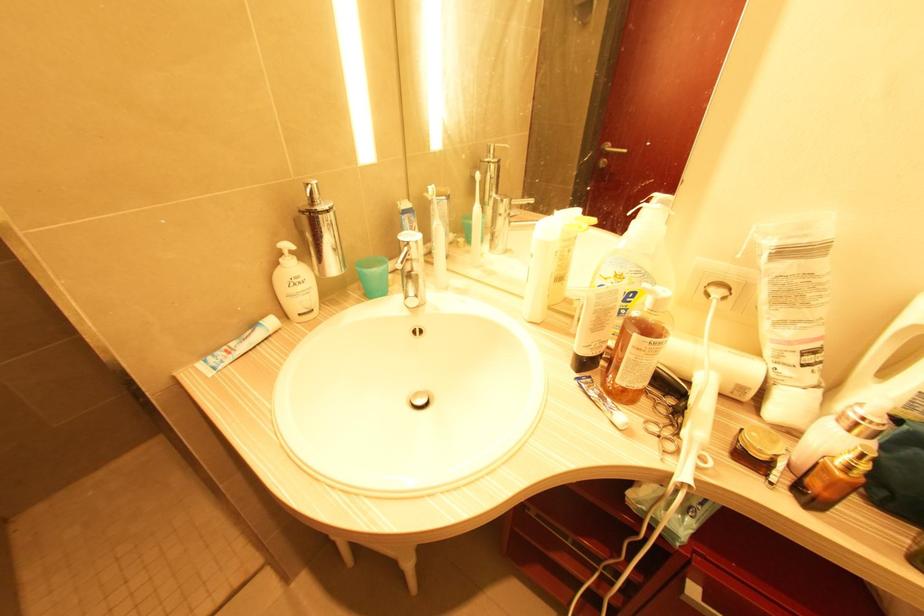
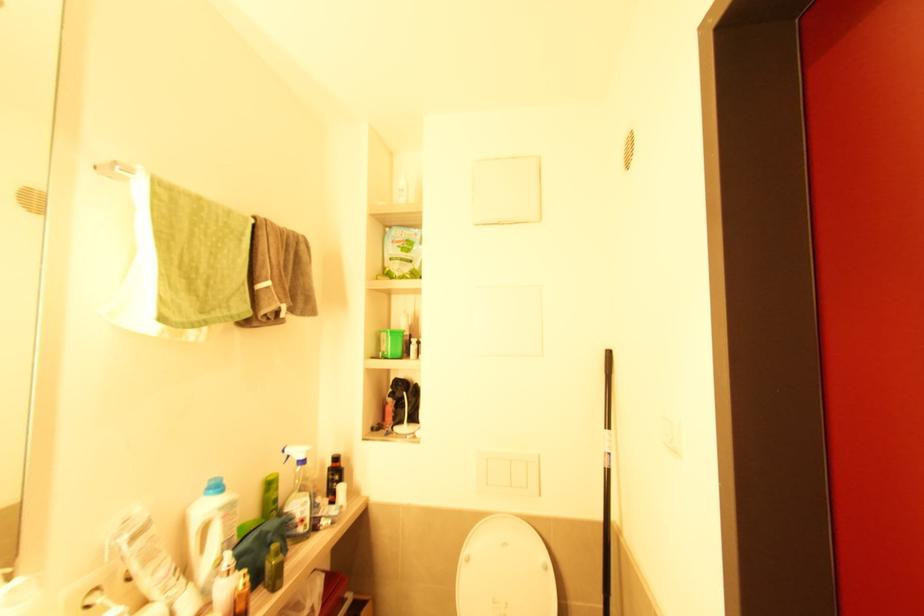
Where in the second image is the point corresponding to [850,468] from the first image?

(247, 585)